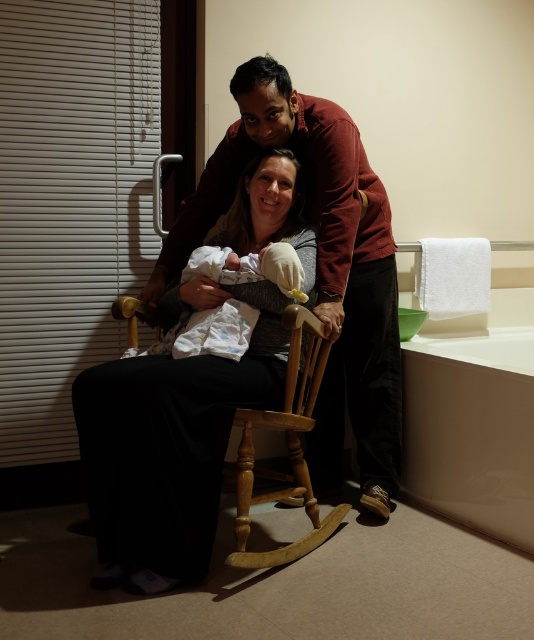
Between matte brown rocking chair at center and white soft cloth at center, which one appears on the right side from the viewer's perspective?

matte brown rocking chair at center

Locate an element on the screen. Image resolution: width=534 pixels, height=640 pixels. matte brown rocking chair at center is located at coordinates (316, 266).

The width and height of the screenshot is (534, 640). Identify the location of matte brown rocking chair at center. (316, 266).